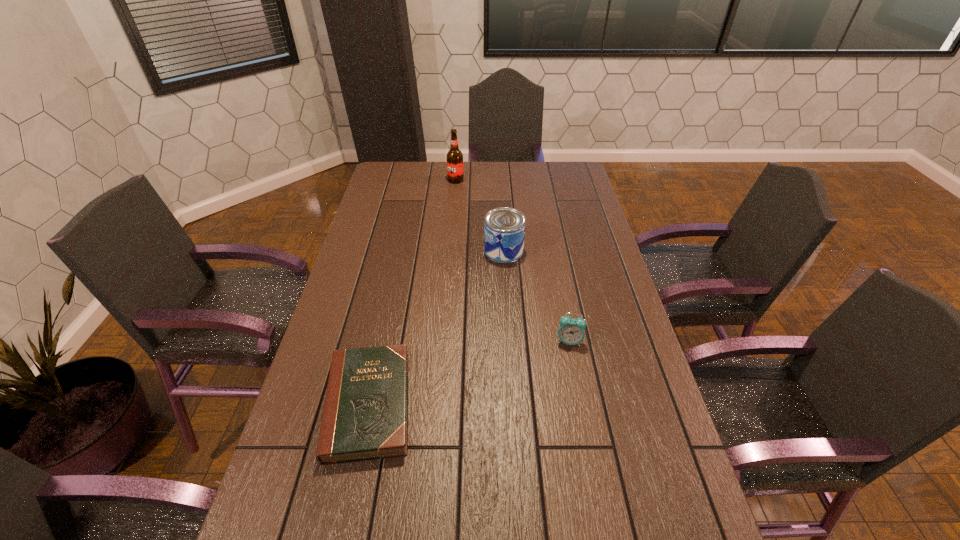
In order to click on free spot located on the front label of the second tallest object in this screenshot , I will do (x=469, y=251).

Locate an element on the screen. This screenshot has height=540, width=960. vacant space situated on the front label of the second tallest object is located at coordinates (394, 251).

You are a GUI agent. You are given a task and a screenshot of the screen. Output one action in this format:
    pyautogui.click(x=<x>, y=<y>)
    Task: Click on the free space located 0.060m on the face of the alarm clock
    This screenshot has height=540, width=960.
    Given the screenshot: What is the action you would take?
    pyautogui.click(x=574, y=366)

Identify the location of free location located on the back of the leftmost object. (393, 291).

Find the location of a particular element. The width and height of the screenshot is (960, 540). object that is at the far edge is located at coordinates point(454,156).

Locate an element on the screen. This screenshot has height=540, width=960. object positioned at the left edge is located at coordinates (365, 416).

Image resolution: width=960 pixels, height=540 pixels. Identify the location of object present at the right edge. (571, 331).

In the image, there is a desktop. In order to click on free space at the far edge in this screenshot , I will do `click(431, 176)`.

The image size is (960, 540). I want to click on blank space at the left edge, so click(x=335, y=497).

The width and height of the screenshot is (960, 540). Find the location of `free space at the right edge`. free space at the right edge is located at coordinates (591, 281).